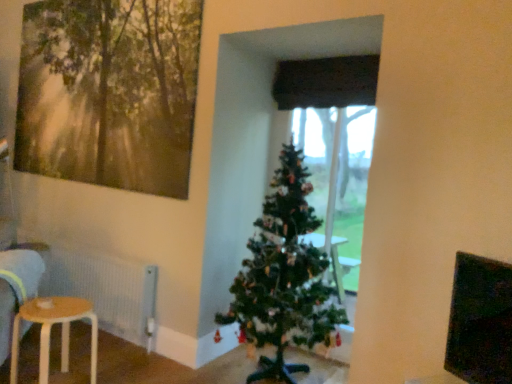
Question: Considering the relative sizes of wooden painting at upper left and white textured radiator at lower left in the image provided, is wooden painting at upper left wider than white textured radiator at lower left?

Choices:
 (A) yes
 (B) no

Answer: (B)

Question: From the image's perspective, is wooden painting at upper left beneath white textured radiator at lower left?

Choices:
 (A) no
 (B) yes

Answer: (A)

Question: Is wooden painting at upper left thinner than white textured radiator at lower left?

Choices:
 (A) yes
 (B) no

Answer: (A)

Question: Is wooden painting at upper left not within white textured radiator at lower left?

Choices:
 (A) no
 (B) yes

Answer: (B)

Question: Is wooden painting at upper left positioned with its back to white textured radiator at lower left?

Choices:
 (A) yes
 (B) no

Answer: (B)

Question: Is wooden painting at upper left at the right side of white textured radiator at lower left?

Choices:
 (A) yes
 (B) no

Answer: (A)

Question: Is wooden painting at upper left oriented away from light brown wooden stool at lower left?

Choices:
 (A) yes
 (B) no

Answer: (B)

Question: Can you confirm if wooden painting at upper left is smaller than light brown wooden stool at lower left?

Choices:
 (A) no
 (B) yes

Answer: (A)

Question: Is wooden painting at upper left wider than light brown wooden stool at lower left?

Choices:
 (A) no
 (B) yes

Answer: (A)

Question: Does wooden painting at upper left appear on the left side of light brown wooden stool at lower left?

Choices:
 (A) no
 (B) yes

Answer: (B)

Question: From a real-world perspective, is wooden painting at upper left positioned over light brown wooden stool at lower left based on gravity?

Choices:
 (A) no
 (B) yes

Answer: (B)

Question: Can light brown wooden stool at lower left be found inside wooden painting at upper left?

Choices:
 (A) no
 (B) yes

Answer: (A)

Question: Can you confirm if black fabric curtain at center is bigger than green matte christmas tree at center?

Choices:
 (A) yes
 (B) no

Answer: (B)